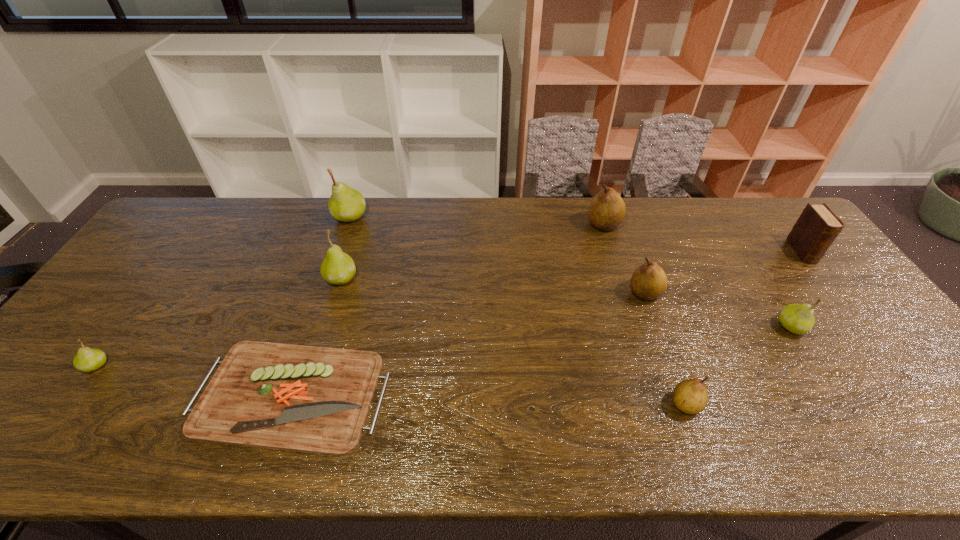
This screenshot has height=540, width=960. I want to click on brown pear that can be found as the second closest to the second farthest green pear, so click(x=649, y=281).

Identify the location of vacant region that satisfies the following two spatial constraints: 1. on the back side of the shortest object; 2. on the left side of the second smallest brown pear. (324, 293).

Where is `blank space that satisfies the following two spatial constraints: 1. on the front side of the second biggest green pear; 2. on the right side of the farthest green pear`? The width and height of the screenshot is (960, 540). blank space that satisfies the following two spatial constraints: 1. on the front side of the second biggest green pear; 2. on the right side of the farthest green pear is located at coordinates (329, 278).

The width and height of the screenshot is (960, 540). Identify the location of free spot that satisfies the following two spatial constraints: 1. on the front side of the nearest brown pear; 2. on the right side of the biggest green pear. (287, 404).

The image size is (960, 540). I want to click on free space that satisfies the following two spatial constraints: 1. on the front side of the farthest brown pear; 2. on the right side of the second smallest brown pear, so click(x=626, y=293).